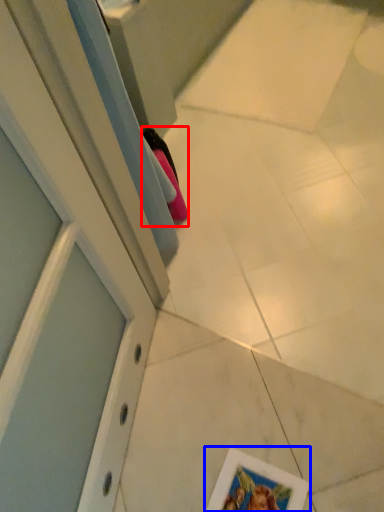
Question: Which point is further to the camera, shoe (highlighted by a red box) or picture frame (highlighted by a blue box)?

Choices:
 (A) shoe
 (B) picture frame

Answer: (A)